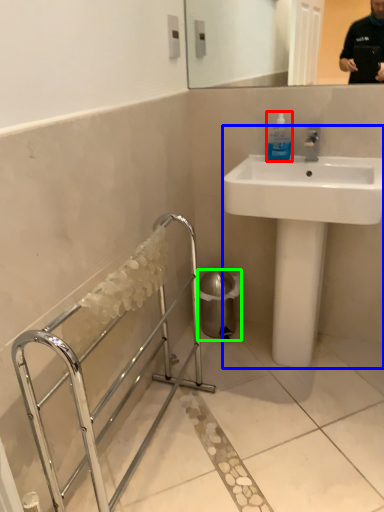
Question: Which object is the closest to the mouthwash (highlighted by a red box)? Choose among these: sink (highlighted by a blue box) or trash bin/can (highlighted by a green box).

Choices:
 (A) sink
 (B) trash bin/can

Answer: (A)